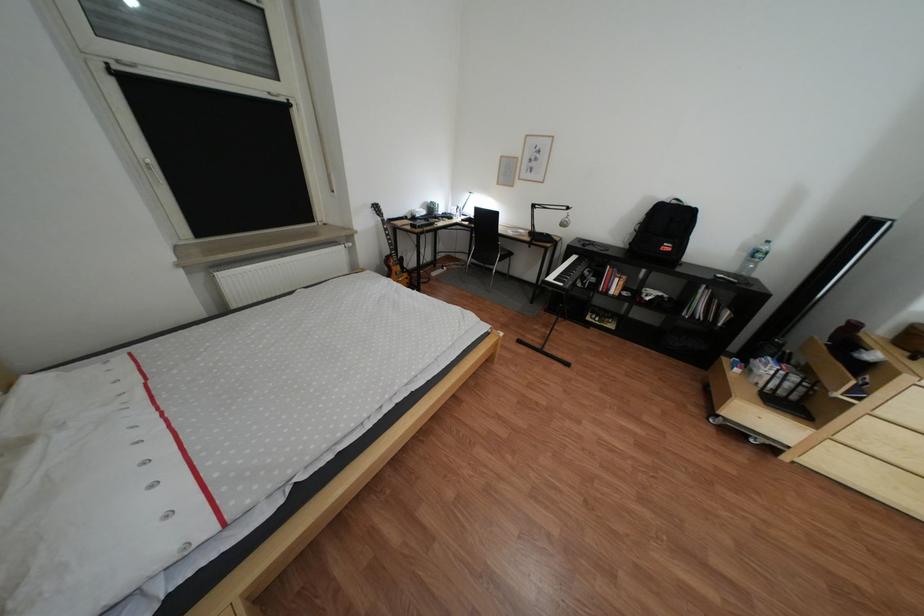
Find where to turn the radiator knob. Please return your answer as a coordinate pair (x, y).

(360, 249)